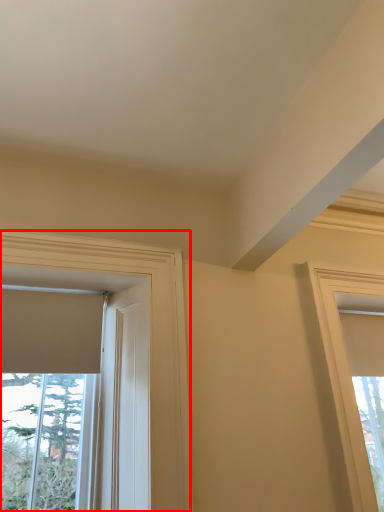
Question: From the image's perspective, where is window (annotated by the red box) located in relation to window in the image?

Choices:
 (A) below
 (B) above

Answer: (B)